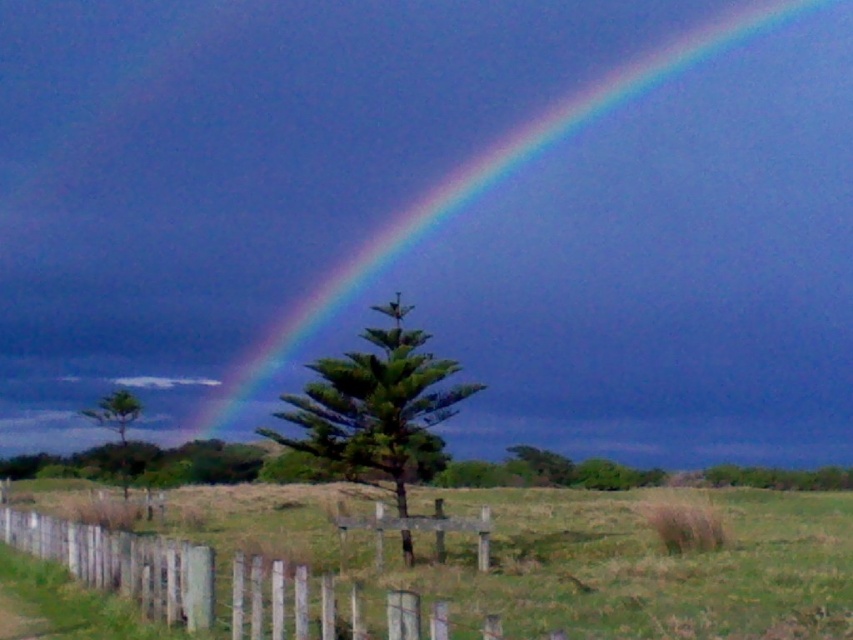
You are standing at the wooden picket fence at center and want to take a photo of the rainbow at upper center. If your camera has a zoom lens capable of focusing up to 100 meters, will you be able to capture the rainbow clearly?

The distance between the rainbow at upper center and the wooden picket fence at center is 85.60 meters, which is within the camera lens focus range of 100 meters. Therefore, you can capture the rainbow clearly.

You are an artist trying to paint the scene. You want to ensure the rainbow at upper center and the wooden picket fence at center are proportionally accurate. Which object should you paint larger?

The rainbow at upper center should be painted larger than the wooden picket fence at center because the rainbow at upper center has a larger size compared to wooden picket fence at center.